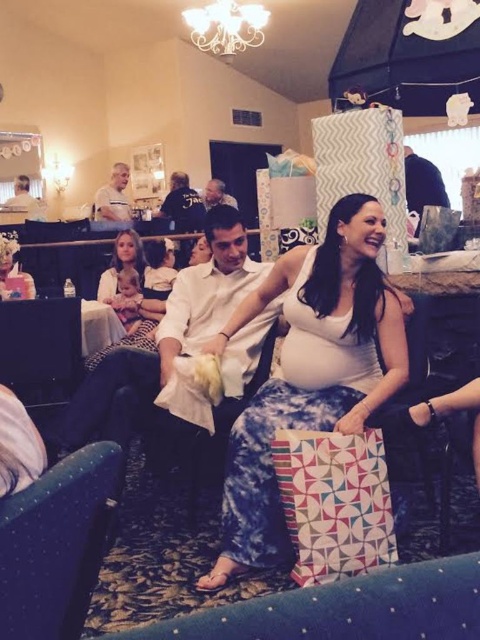
Question: Does white matte dress at center have a greater width compared to geometric-patterned paper bag at center?

Choices:
 (A) no
 (B) yes

Answer: (B)

Question: Which point is closer to the camera taking this photo?

Choices:
 (A) (21, 180)
 (B) (242, 416)
 (C) (382, 547)
 (D) (215, 204)

Answer: (C)

Question: Does white fabric shirt at center appear under matte white shirt at upper left?

Choices:
 (A) yes
 (B) no

Answer: (A)

Question: Which of the following is the farthest from the observer?

Choices:
 (A) geometric-patterned paper bag at center
 (B) matte white belly at center
 (C) matte white shirt at upper left
 (D) white matte dress at center

Answer: (C)

Question: Is white matte dress at center smaller than matte white shirt at upper left?

Choices:
 (A) no
 (B) yes

Answer: (A)

Question: Considering the real-world distances, which object is closest to the white fabric shirt at center?

Choices:
 (A) geometric-patterned paper bag at center
 (B) matte white shirt at upper left
 (C) white matte shirt at upper left
 (D) matte white belly at center

Answer: (C)